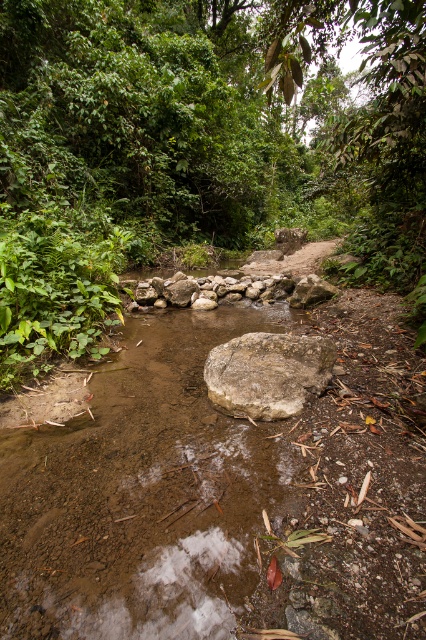
Question: Is gray rough rock at center wider than natural stone at center?

Choices:
 (A) yes
 (B) no

Answer: (B)

Question: Is gray rough rock at center bigger than natural stone at center?

Choices:
 (A) yes
 (B) no

Answer: (B)

Question: Among these objects, which one is nearest to the camera?

Choices:
 (A) gray rough rock at center
 (B) natural stone at center

Answer: (A)

Question: Which point is closer to the camera taking this photo?

Choices:
 (A) (215, 376)
 (B) (247, 291)

Answer: (A)

Question: Can you confirm if gray rough rock at center is positioned to the right of natural stone at center?

Choices:
 (A) no
 (B) yes

Answer: (B)

Question: Which object is closer to the camera taking this photo?

Choices:
 (A) natural stone at center
 (B) gray rough rock at center

Answer: (B)